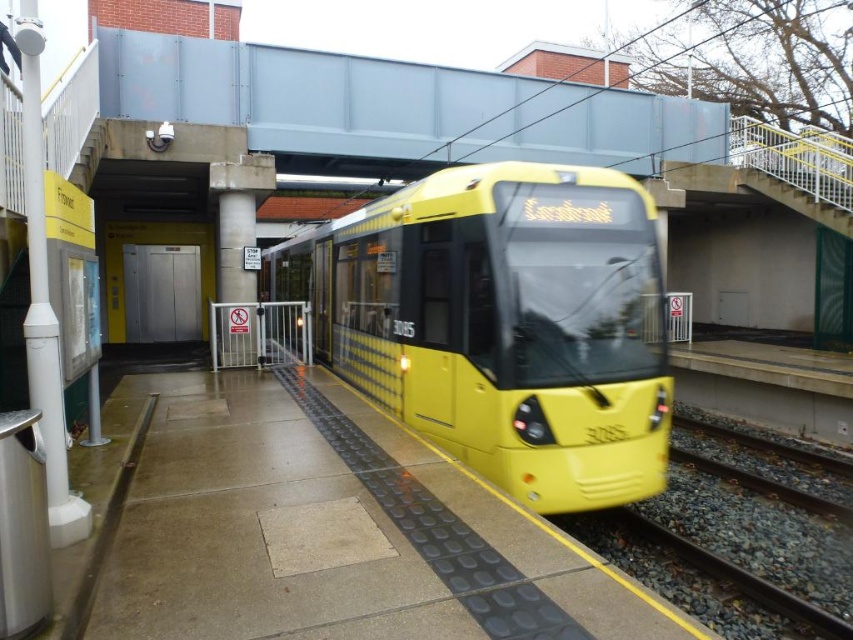
Question: Which point appears farthest from the camera in this image?

Choices:
 (A) (502, 339)
 (B) (587, 163)

Answer: (B)

Question: Is yellow matte train at center positioned at the back of gravel train track at lower right?

Choices:
 (A) yes
 (B) no

Answer: (B)

Question: Which point is closer to the camera taking this photo?

Choices:
 (A) (572, 156)
 (B) (608, 532)
 (C) (366, 224)

Answer: (B)

Question: Which object is closer to the camera taking this photo?

Choices:
 (A) gravel train track at lower right
 (B) gray concrete bridge at upper center

Answer: (A)

Question: Is yellow matte train at center bigger than gray concrete bridge at upper center?

Choices:
 (A) yes
 (B) no

Answer: (A)

Question: Can you confirm if yellow matte train at center is bigger than gray concrete bridge at upper center?

Choices:
 (A) no
 (B) yes

Answer: (B)